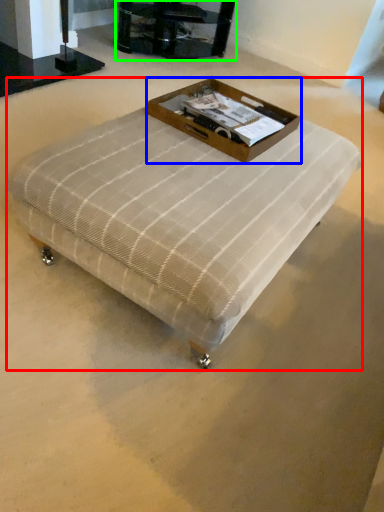
Question: Considering the real-world distances, which object is closest to table (highlighted by a red box)? box (highlighted by a blue box) or furniture (highlighted by a green box).

Choices:
 (A) box
 (B) furniture

Answer: (A)